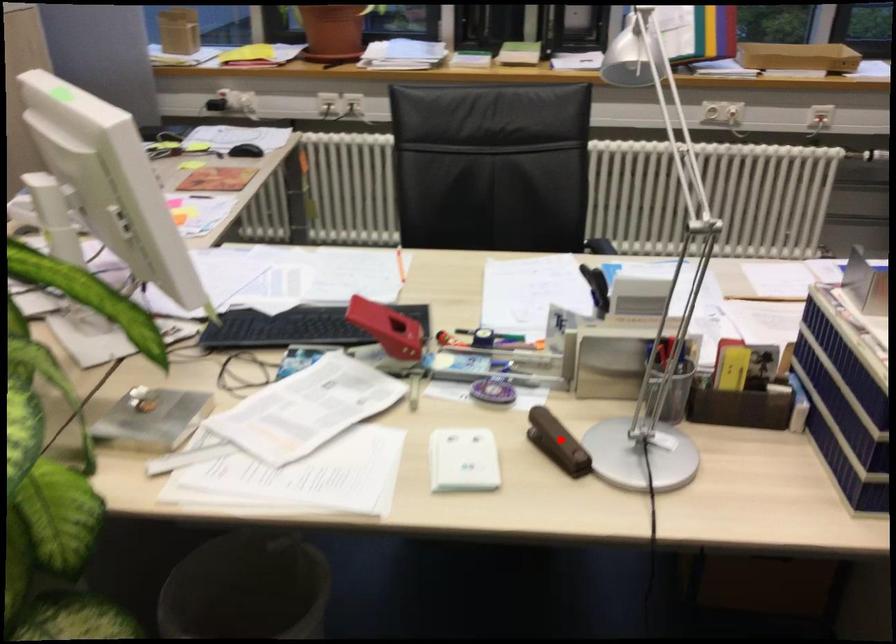
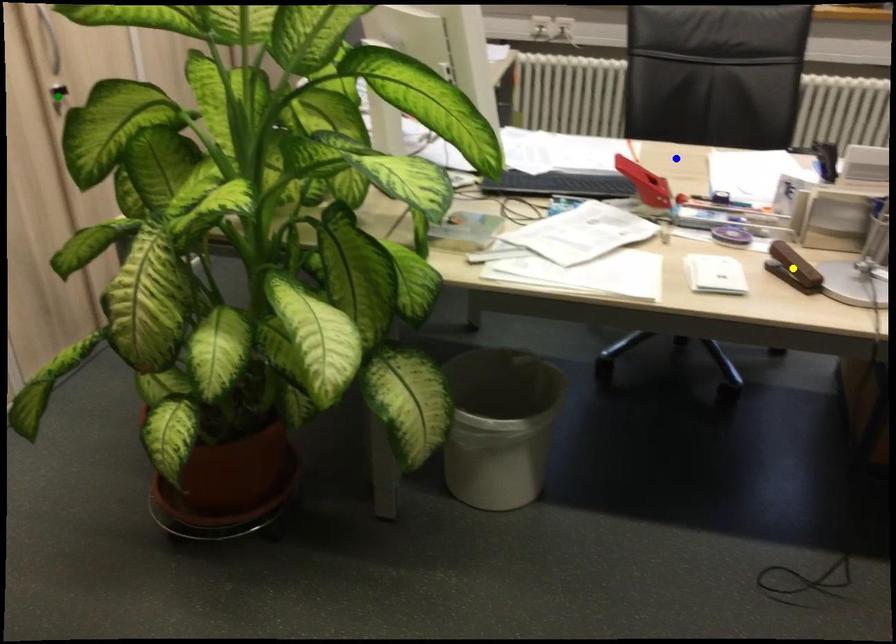
Question: I am providing you with two images of the same scene from different viewpoints. A red point is marked on the first image. You are given multiple points on the second image. Which point in image 2 is actually the same real-world point as the red point in image 1?

Choices:
 (A) blue point
 (B) yellow point
 (C) green point

Answer: (B)